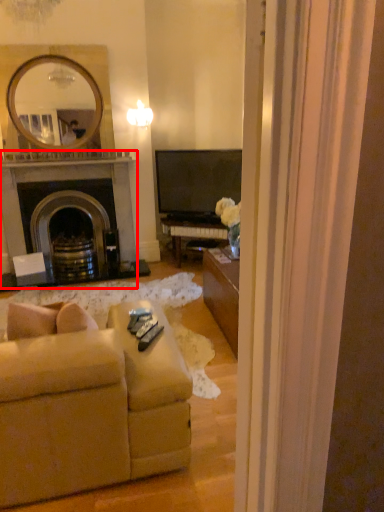
Question: From the image's perspective, considering the relative positions of fireplace (annotated by the red box) and studio couch in the image provided, where is fireplace (annotated by the red box) located with respect to the staircase?

Choices:
 (A) above
 (B) below

Answer: (A)